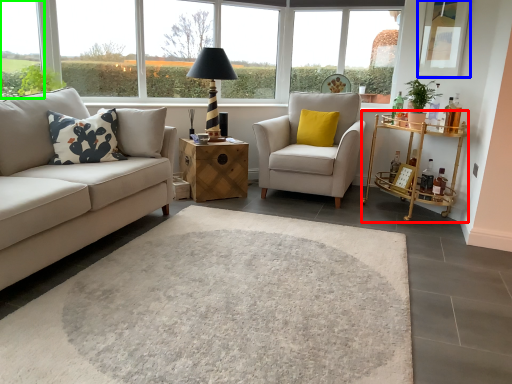
Question: Estimate the real-world distances between objects in this image. Which object is closer to table (highlighted by a red box), window screen (highlighted by a blue box) or window (highlighted by a green box)?

Choices:
 (A) window screen
 (B) window

Answer: (A)